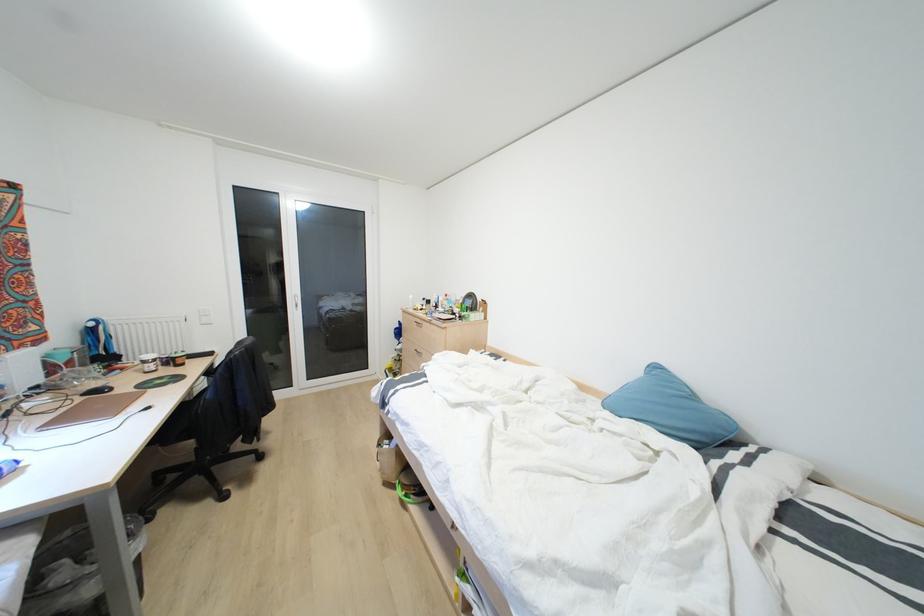
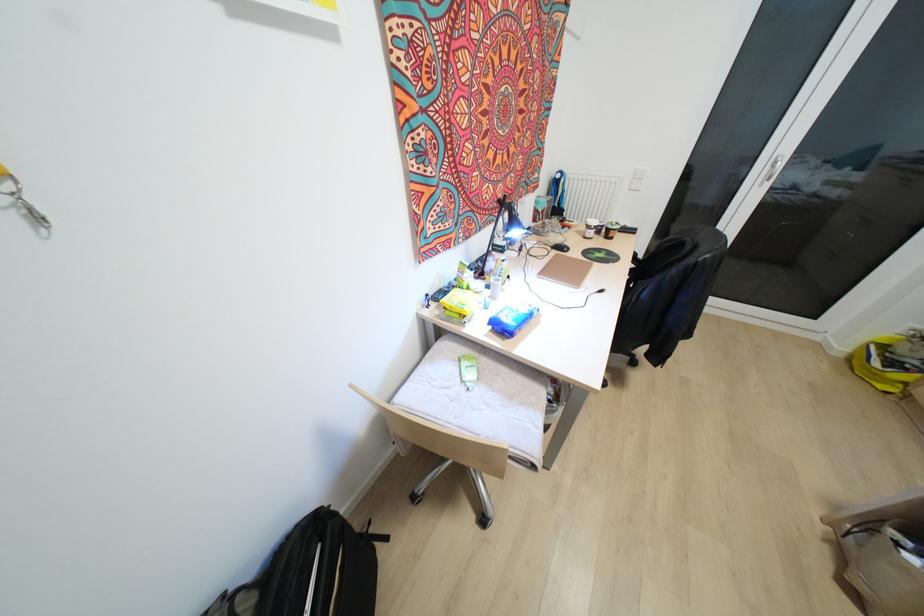
Where in the second image is the point corresponding to pixel 150 355 from the first image?

(592, 222)